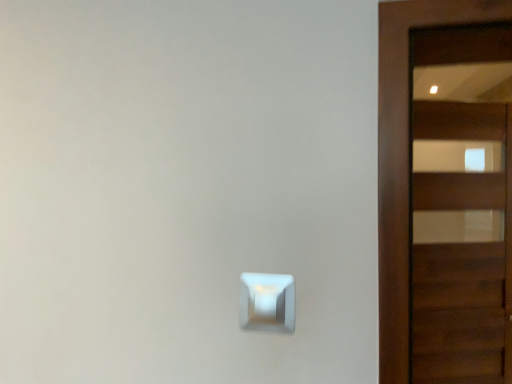
Question: Does white glossy light switch at center have a lesser width compared to wooden door at right?

Choices:
 (A) no
 (B) yes

Answer: (B)

Question: Is the position of white glossy light switch at center less distant than that of wooden door at right?

Choices:
 (A) yes
 (B) no

Answer: (A)

Question: Considering the relative sizes of white glossy light switch at center and wooden door at right in the image provided, is white glossy light switch at center taller than wooden door at right?

Choices:
 (A) yes
 (B) no

Answer: (B)

Question: Can you confirm if white glossy light switch at center is positioned to the right of wooden door at right?

Choices:
 (A) yes
 (B) no

Answer: (B)

Question: Can you confirm if white glossy light switch at center is bigger than wooden door at right?

Choices:
 (A) yes
 (B) no

Answer: (B)

Question: Is white glossy light switch at center further to camera compared to wooden door at right?

Choices:
 (A) yes
 (B) no

Answer: (B)

Question: Is wooden door at right facing towards white glossy light switch at center?

Choices:
 (A) no
 (B) yes

Answer: (A)

Question: Can you confirm if wooden door at right is positioned to the left of white glossy light switch at center?

Choices:
 (A) no
 (B) yes

Answer: (A)

Question: From the image's perspective, is wooden door at right above white glossy light switch at center?

Choices:
 (A) no
 (B) yes

Answer: (B)

Question: From a real-world perspective, is wooden door at right over white glossy light switch at center?

Choices:
 (A) no
 (B) yes

Answer: (B)

Question: Would you consider wooden door at right to be distant from white glossy light switch at center?

Choices:
 (A) yes
 (B) no

Answer: (B)

Question: Is wooden door at right facing away from white glossy light switch at center?

Choices:
 (A) no
 (B) yes

Answer: (A)

Question: Based on their positions, is white glossy light switch at center located to the left or right of wooden door at right?

Choices:
 (A) right
 (B) left

Answer: (B)